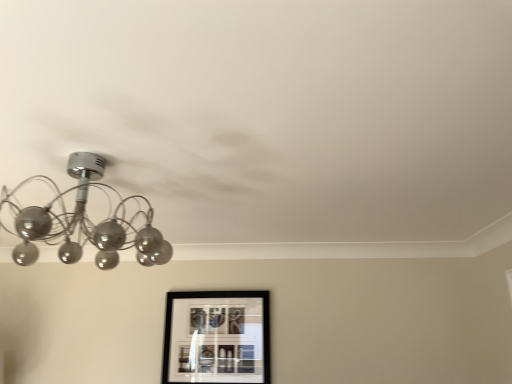
Find the location of a particular element. The height and width of the screenshot is (384, 512). metallic glass chandelier at upper left is located at coordinates (83, 222).

The width and height of the screenshot is (512, 384). What do you see at coordinates (83, 222) in the screenshot? I see `metallic glass chandelier at upper left` at bounding box center [83, 222].

This screenshot has width=512, height=384. Identify the location of black matte picture frame at lower center. (217, 337).

This screenshot has width=512, height=384. Describe the element at coordinates (217, 337) in the screenshot. I see `black matte picture frame at lower center` at that location.

Locate an element on the screen. The width and height of the screenshot is (512, 384). metallic glass chandelier at upper left is located at coordinates (83, 222).

Is black matte picture frame at lower center to the left of metallic glass chandelier at upper left from the viewer's perspective?

In fact, black matte picture frame at lower center is to the right of metallic glass chandelier at upper left.

Considering the positions of objects black matte picture frame at lower center and metallic glass chandelier at upper left in the image provided, who is behind, black matte picture frame at lower center or metallic glass chandelier at upper left?

Positioned behind is black matte picture frame at lower center.

Does point (205, 302) lie in front of point (47, 235)?

No, (205, 302) is behind (47, 235).

Based on the photo, from the image's perspective, is black matte picture frame at lower center over metallic glass chandelier at upper left?

No, from the image's perspective, black matte picture frame at lower center is not on top of metallic glass chandelier at upper left.

From a real-world perspective, which is physically above, black matte picture frame at lower center or metallic glass chandelier at upper left?

metallic glass chandelier at upper left.

Considering the relative sizes of black matte picture frame at lower center and metallic glass chandelier at upper left in the image provided, is black matte picture frame at lower center thinner than metallic glass chandelier at upper left?

Correct, the width of black matte picture frame at lower center is less than that of metallic glass chandelier at upper left.

Between black matte picture frame at lower center and metallic glass chandelier at upper left, which one has less height?

Standing shorter between the two is metallic glass chandelier at upper left.

Which of these two, black matte picture frame at lower center or metallic glass chandelier at upper left, is bigger?

With larger size is metallic glass chandelier at upper left.

Is metallic glass chandelier at upper left surrounded by black matte picture frame at lower center?

Definitely not — metallic glass chandelier at upper left is not inside black matte picture frame at lower center.

Is black matte picture frame at lower center in contact with metallic glass chandelier at upper left?

black matte picture frame at lower center is not next to metallic glass chandelier at upper left, and they're not touching.

Is black matte picture frame at lower center oriented towards metallic glass chandelier at upper left?

Yes, black matte picture frame at lower center is oriented towards metallic glass chandelier at upper left.

Find the location of a particular element. This screenshot has height=384, width=512. lamp that appears on the left of black matte picture frame at lower center is located at coordinates (83, 222).

Between metallic glass chandelier at upper left and black matte picture frame at lower center, which one appears on the right side from the viewer's perspective?

black matte picture frame at lower center.

Considering the positions of objects metallic glass chandelier at upper left and black matte picture frame at lower center in the image provided, who is in front, metallic glass chandelier at upper left or black matte picture frame at lower center?

metallic glass chandelier at upper left is more forward.

Which point is more forward, (x=137, y=257) or (x=172, y=292)?

Point (x=137, y=257)

From the image's perspective, is metallic glass chandelier at upper left located above black matte picture frame at lower center?

Correct, metallic glass chandelier at upper left appears higher than black matte picture frame at lower center in the image.

From a real-world perspective, is metallic glass chandelier at upper left under black matte picture frame at lower center?

No, from a real-world perspective, metallic glass chandelier at upper left is not beneath black matte picture frame at lower center.

Can you confirm if metallic glass chandelier at upper left is thinner than black matte picture frame at lower center?

In fact, metallic glass chandelier at upper left might be wider than black matte picture frame at lower center.

Considering the sizes of objects metallic glass chandelier at upper left and black matte picture frame at lower center in the image provided, who is shorter, metallic glass chandelier at upper left or black matte picture frame at lower center?

Standing shorter between the two is metallic glass chandelier at upper left.

Is metallic glass chandelier at upper left bigger than black matte picture frame at lower center?

Yes, metallic glass chandelier at upper left is bigger than black matte picture frame at lower center.

Could black matte picture frame at lower center be considered to be inside metallic glass chandelier at upper left?

Definitely not — black matte picture frame at lower center is not inside metallic glass chandelier at upper left.

Is metallic glass chandelier at upper left far from black matte picture frame at lower center?

metallic glass chandelier at upper left is near black matte picture frame at lower center, not far away.

Does metallic glass chandelier at upper left turn towards black matte picture frame at lower center?

No, metallic glass chandelier at upper left does not turn towards black matte picture frame at lower center.

What's the angular difference between metallic glass chandelier at upper left and black matte picture frame at lower center's facing directions?

metallic glass chandelier at upper left and black matte picture frame at lower center are facing 94.5 degrees away from each other.

In the image, there is a metallic glass chandelier at upper left. At what (x,y) coordinates should I click in order to perform the action: click on picture frame below it (from a real-world perspective). Please return your answer as a coordinate pair (x, y). This screenshot has height=384, width=512. Looking at the image, I should click on (217, 337).

Find the location of `picture frame lying on the right of metallic glass chandelier at upper left`. picture frame lying on the right of metallic glass chandelier at upper left is located at coordinates (217, 337).

Find the location of a particular element. This screenshot has height=384, width=512. picture frame below the metallic glass chandelier at upper left (from a real-world perspective) is located at coordinates (217, 337).